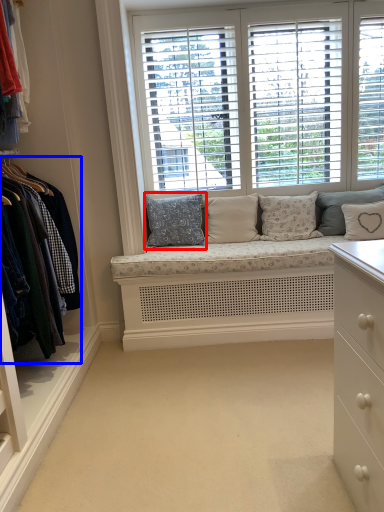
Question: Which object appears farthest to the camera in this image, pillow (highlighted by a red box) or closet (highlighted by a blue box)?

Choices:
 (A) pillow
 (B) closet

Answer: (A)